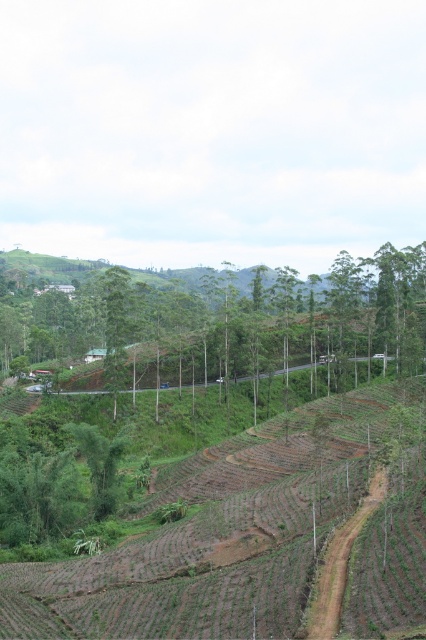
You are standing at the point marked by the coordinates point (218,320) in the image. Which object is located exactly at your current position?

The green leafy tree at center is located exactly at the point (218,320).

You are standing at the starting point of the road in the middle ground of the hilly landscape. You see two points marked on the map, point (x=124, y=333) and point (x=328, y=605). Which point is closer to you?

Point (x=328, y=605) is closer to you because point (x=124, y=333) is behind it.